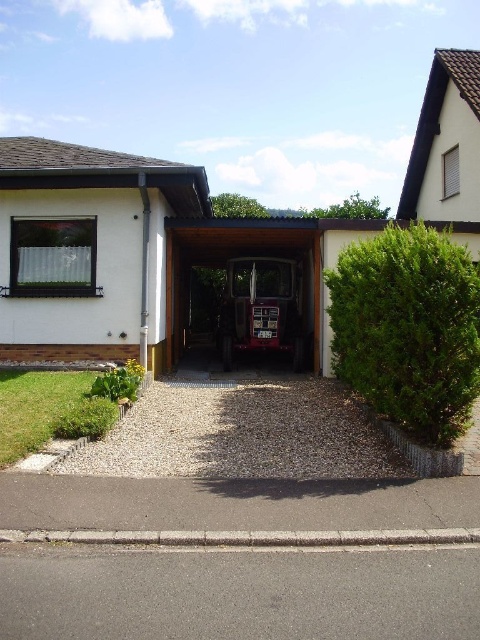
Based on the photo, you are standing at the entrance of the house and want to place a small garden statue between the two points labeled point (139, 557) and point (277, 316). Which point should the statue be closer to if you want it to be closer to the house?

The statue should be closer to point (277, 316) because point (139, 557) is in front of it, meaning point (277, 316) is closer to the house.

You are planning to park a trailer that is 2 meters wide in the driveway. The driveway is made of asphalt at lower center. Can the trailer fit in the driveway without overlapping the metallic red tractor at center?

The asphalt at lower center has a width larger than the metallic red tractor at center. Since the trailer is 2 meters wide, it can fit in the driveway as long as there is enough space alongside the tractor.

Looking at this image, you are standing at the entrance of the house and want to walk to the carport where the red tractor is parked. Which direction should you head from the asphalt at lower center to reach the carport?

The asphalt at lower center is located at point [239,593]. Since the carport is part of the house structure and the asphalt is at the lower center, you should head towards the upper right direction to reach the carport where the red tractor is parked.